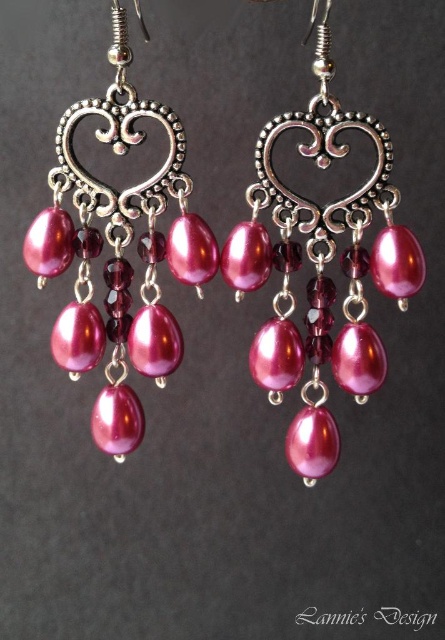
You are standing 5 feet away from the camera. If you want to view the pink pearl earrings at center clearly, will you be able to see them without moving closer?

The pink pearl earrings at center is 3.53 feet away from camera. Since you are standing 5 feet away from the camera, you are farther away than the earrings, so you may not be able to see them clearly without moving closer.

You are a jeweler examining a pair of chandelier earrings. You notice a point marked at coordinates [322,269]. Based on the description, which object does this point correspond to?

The point at [322,269] corresponds to the pink pearl earrings at center as indicated in the description.